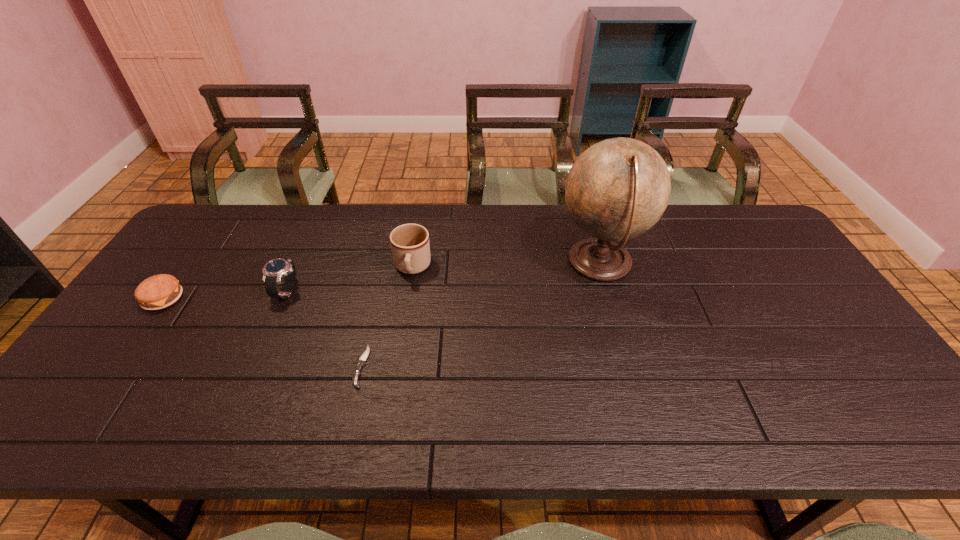
Image resolution: width=960 pixels, height=540 pixels. I want to click on the tallest object, so click(x=617, y=189).

This screenshot has width=960, height=540. In order to click on the rightmost object in this screenshot , I will do `click(617, 189)`.

The image size is (960, 540). In order to click on mug in this screenshot , I will do `click(410, 246)`.

The width and height of the screenshot is (960, 540). What are the coordinates of `watch` in the screenshot? It's located at (274, 270).

This screenshot has width=960, height=540. Identify the location of the leftmost object. (160, 291).

You are a GUI agent. You are given a task and a screenshot of the screen. Output one action in this format:
    pyautogui.click(x=<x>, y=<y>)
    Task: Click on the hamburger
    This screenshot has height=540, width=960.
    Given the screenshot: What is the action you would take?
    pyautogui.click(x=160, y=291)

Locate an element on the screen. Image resolution: width=960 pixels, height=540 pixels. pocketknife is located at coordinates (357, 372).

Identify the location of the nearest object. The width and height of the screenshot is (960, 540). (357, 372).

Locate an element on the screen. vacant space located on the front-facing side of the globe is located at coordinates (503, 263).

Locate an element on the screen. The width and height of the screenshot is (960, 540). free space located 0.300m on the front-facing side of the globe is located at coordinates (457, 263).